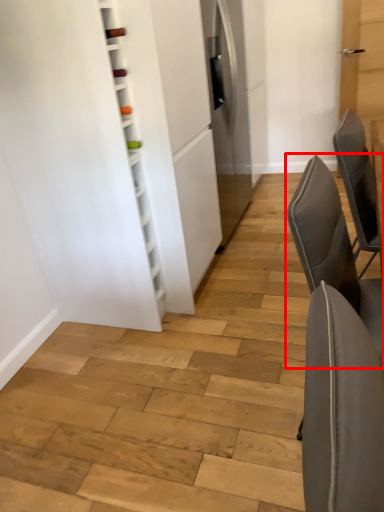
Question: Considering the relative positions of chair (annotated by the red box) and chair in the image provided, where is chair (annotated by the red box) located with respect to the staircase?

Choices:
 (A) right
 (B) left

Answer: (B)